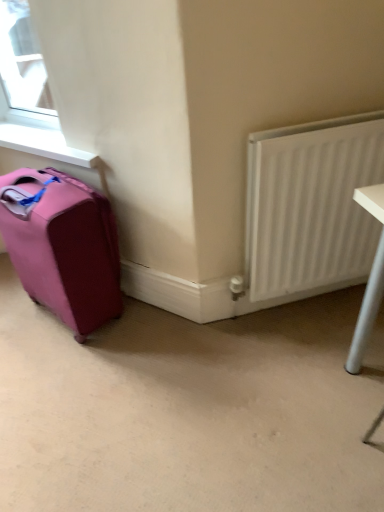
What do you see at coordinates (62, 246) in the screenshot? The image size is (384, 512). I see `pink fabric suitcase at left` at bounding box center [62, 246].

Where is `beige carpet at lower center`? The height and width of the screenshot is (512, 384). beige carpet at lower center is located at coordinates 189,409.

Would you say beige carpet at lower center is part of white smooth window sill at upper left's contents?

No.

Between white smooth window sill at upper left and beige carpet at lower center, which one has more height?

Standing taller between the two is white smooth window sill at upper left.

Are white smooth window sill at upper left and beige carpet at lower center located far from each other?

white smooth window sill at upper left is actually quite close to beige carpet at lower center.

Locate an element on the screen. concrete below the white smooth window sill at upper left (from a real-world perspective) is located at coordinates tap(189, 409).

Locate an element on the screen. window sill above the white textured radiator at right (from a real-world perspective) is located at coordinates (44, 144).

From a real-world perspective, is white smooth window sill at upper left on white textured radiator at right?

Yes, from a real-world perspective, white smooth window sill at upper left is on top of white textured radiator at right.

Considering the sizes of objects white smooth window sill at upper left and white textured radiator at right in the image provided, who is shorter, white smooth window sill at upper left or white textured radiator at right?

Standing shorter between the two is white smooth window sill at upper left.

Looking at this image, considering the sizes of objects white smooth window sill at upper left and white textured radiator at right in the image provided, who is wider, white smooth window sill at upper left or white textured radiator at right?

white smooth window sill at upper left.

From the image's perspective, is pink fabric suitcase at left over beige carpet at lower center?

Yes, from the image's perspective, pink fabric suitcase at left is above beige carpet at lower center.

Looking at this image, would you consider pink fabric suitcase at left to be distant from beige carpet at lower center?

Actually, pink fabric suitcase at left and beige carpet at lower center are a little close together.

From a real-world perspective, is pink fabric suitcase at left physically below beige carpet at lower center?

Incorrect, from a real-world perspective, pink fabric suitcase at left is higher than beige carpet at lower center.

Between pink fabric suitcase at left and beige carpet at lower center, which one has larger size?

Bigger between the two is pink fabric suitcase at left.

Is point (298, 249) less distant than point (40, 137)?

Yes.

Locate an element on the screen. window sill above the white textured radiator at right (from the image's perspective) is located at coordinates (44, 144).

In the scene shown: From the image's perspective, which one is positioned higher, white textured radiator at right or white smooth window sill at upper left?

From the image's view, white smooth window sill at upper left is above.

Is white textured radiator at right shorter than white smooth window sill at upper left?

No.

Considering the positions of objects white textured radiator at right and pink fabric suitcase at left in the image provided, who is more to the right, white textured radiator at right or pink fabric suitcase at left?

white textured radiator at right.

From the image's perspective, is white textured radiator at right on top of pink fabric suitcase at left?

Yes, from the image's perspective, white textured radiator at right is above pink fabric suitcase at left.

Is white textured radiator at right located outside pink fabric suitcase at left?

That's correct, white textured radiator at right is outside of pink fabric suitcase at left.

Can white textured radiator at right be found inside pink fabric suitcase at left?

Definitely not — white textured radiator at right is not inside pink fabric suitcase at left.

Is pink fabric suitcase at left oriented away from white textured radiator at right?

pink fabric suitcase at left does not have its back to white textured radiator at right.

From a real-world perspective, is pink fabric suitcase at left on white textured radiator at right?

No, from a real-world perspective, pink fabric suitcase at left is not on top of white textured radiator at right.

This screenshot has width=384, height=512. I want to click on radiator that appears in front of the pink fabric suitcase at left, so click(311, 204).

Is pink fabric suitcase at left further to the viewer compared to white smooth window sill at upper left?

That is False.

From the image's perspective, is pink fabric suitcase at left on white smooth window sill at upper left?

Actually, pink fabric suitcase at left appears below white smooth window sill at upper left in the image.

Would you say white smooth window sill at upper left is part of pink fabric suitcase at left's contents?

No, pink fabric suitcase at left does not contain white smooth window sill at upper left.

Is pink fabric suitcase at left shorter than white smooth window sill at upper left?

In fact, pink fabric suitcase at left may be taller than white smooth window sill at upper left.

Locate an element on the screen. concrete located underneath the white smooth window sill at upper left (from a real-world perspective) is located at coordinates (189, 409).

You are a GUI agent. You are given a task and a screenshot of the screen. Output one action in this format:
    pyautogui.click(x=<x>, y=<y>)
    Task: Click on the window sill above the white textured radiator at right (from a real-world perspective)
    The width and height of the screenshot is (384, 512).
    Given the screenshot: What is the action you would take?
    pyautogui.click(x=44, y=144)

Looking at this image, from the image, which object appears to be nearer to pink fabric suitcase at left, white textured radiator at right or white smooth window sill at upper left?

The object closer to pink fabric suitcase at left is white smooth window sill at upper left.

Which object lies nearer to the anchor point white textured radiator at right, beige carpet at lower center or pink fabric suitcase at left?

beige carpet at lower center is closer to white textured radiator at right.

Looking at the image, which one is located further to white textured radiator at right, pink fabric suitcase at left or white smooth window sill at upper left?

The object further to white textured radiator at right is white smooth window sill at upper left.

Based on their spatial positions, is beige carpet at lower center or white textured radiator at right closer to pink fabric suitcase at left?

beige carpet at lower center lies closer to pink fabric suitcase at left than the other object.

Estimate the real-world distances between objects in this image. Which object is closer to white textured radiator at right, white smooth window sill at upper left or beige carpet at lower center?

beige carpet at lower center is closer to white textured radiator at right.

From the picture: Based on their spatial positions, is pink fabric suitcase at left or beige carpet at lower center closer to white textured radiator at right?

beige carpet at lower center is closer to white textured radiator at right.

Estimate the real-world distances between objects in this image. Which object is closer to white textured radiator at right, white smooth window sill at upper left or pink fabric suitcase at left?

pink fabric suitcase at left lies closer to white textured radiator at right than the other object.

Based on their spatial positions, is white textured radiator at right or white smooth window sill at upper left closer to beige carpet at lower center?

The object closer to beige carpet at lower center is white textured radiator at right.

At what (x,y) coordinates should I click in order to perform the action: click on concrete situated between white smooth window sill at upper left and white textured radiator at right from left to right. Please return your answer as a coordinate pair (x, y). The height and width of the screenshot is (512, 384). Looking at the image, I should click on (189, 409).

Find the location of a particular element. luggage and bags between white smooth window sill at upper left and white textured radiator at right in the horizontal direction is located at coordinates (62, 246).

This screenshot has height=512, width=384. I want to click on luggage and bags that lies between white smooth window sill at upper left and beige carpet at lower center from top to bottom, so click(62, 246).

Image resolution: width=384 pixels, height=512 pixels. What are the coordinates of `concrete situated between pink fabric suitcase at left and white textured radiator at right from left to right` in the screenshot? It's located at coord(189,409).